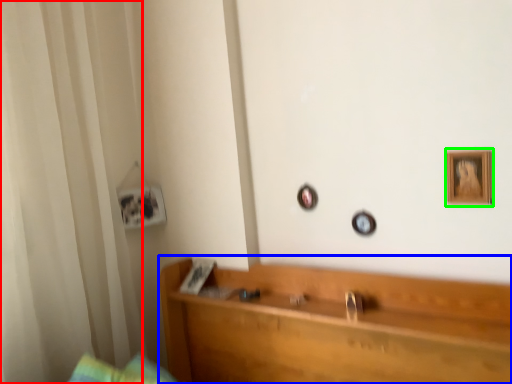
Question: Based on their relative distances, which object is farther from curtain (highlighted by a red box)? Choose from furniture (highlighted by a blue box) and picture frame (highlighted by a green box).

Choices:
 (A) furniture
 (B) picture frame

Answer: (B)